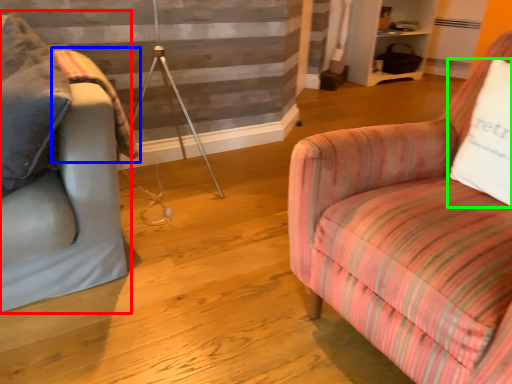
Question: Based on their relative distances, which object is nearer to studio couch (highlighted by a red box)? Choose from blanket (highlighted by a blue box) and pillow (highlighted by a green box).

Choices:
 (A) blanket
 (B) pillow

Answer: (A)